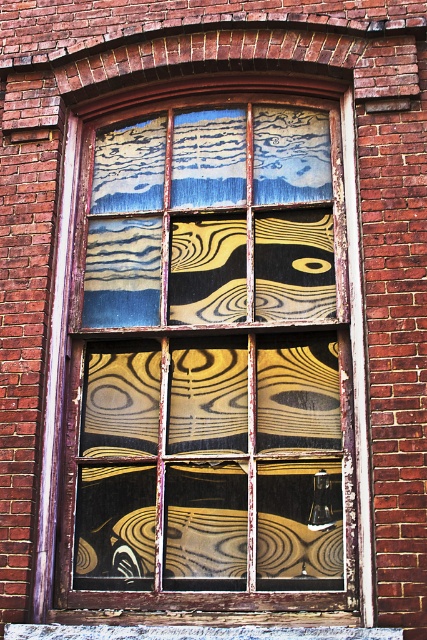
Between wooden window at center and wooden at lower center, which one has less height?

Standing shorter between the two is wooden at lower center.

Who is more distant from viewer, (263, 378) or (175, 625)?

Point (263, 378)

The width and height of the screenshot is (427, 640). What are the coordinates of `wooden window at center` in the screenshot? It's located at (207, 356).